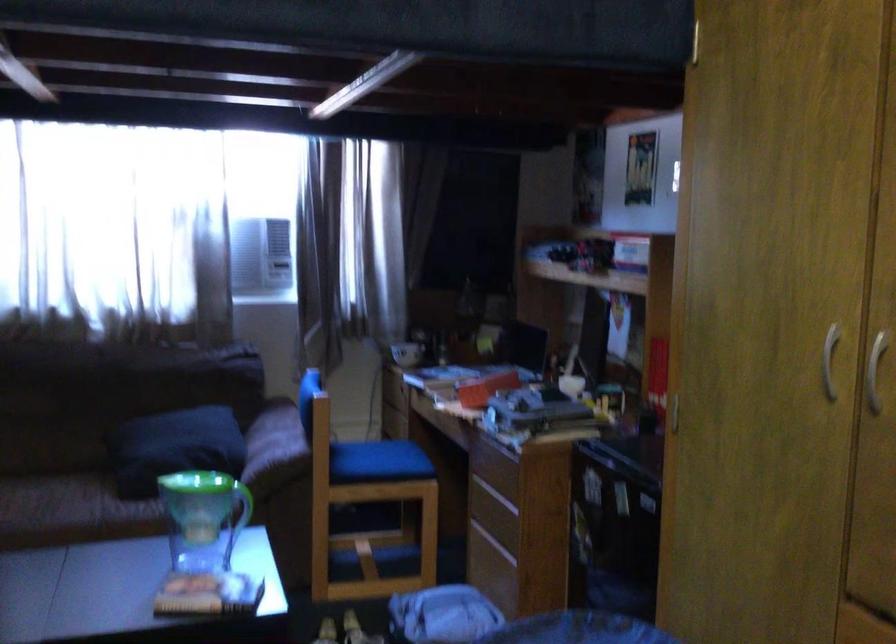
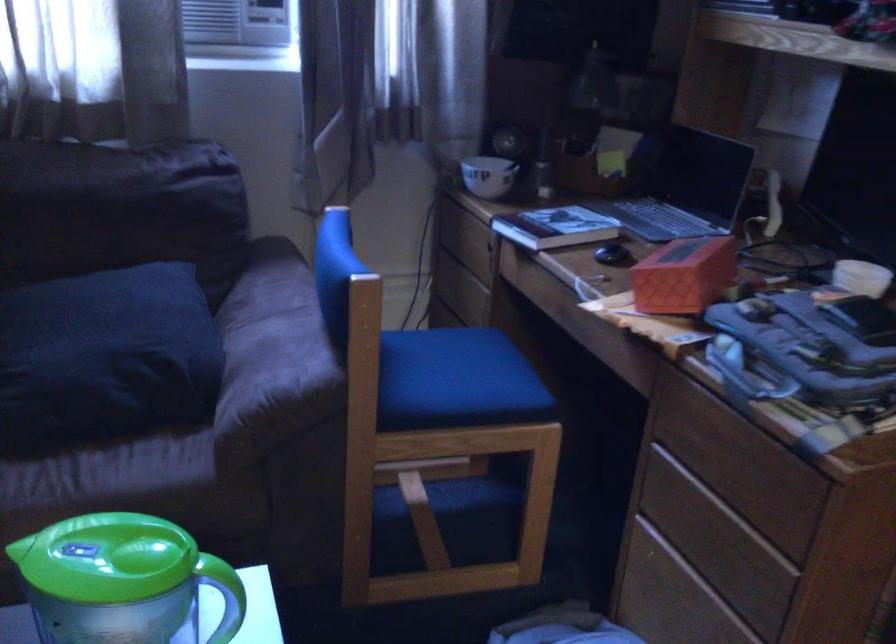
Question: The images are taken continuously from a first-person perspective. In which direction are you moving?

Choices:
 (A) Left
 (B) Right
 (C) Forward
 (D) Backward

Answer: (C)